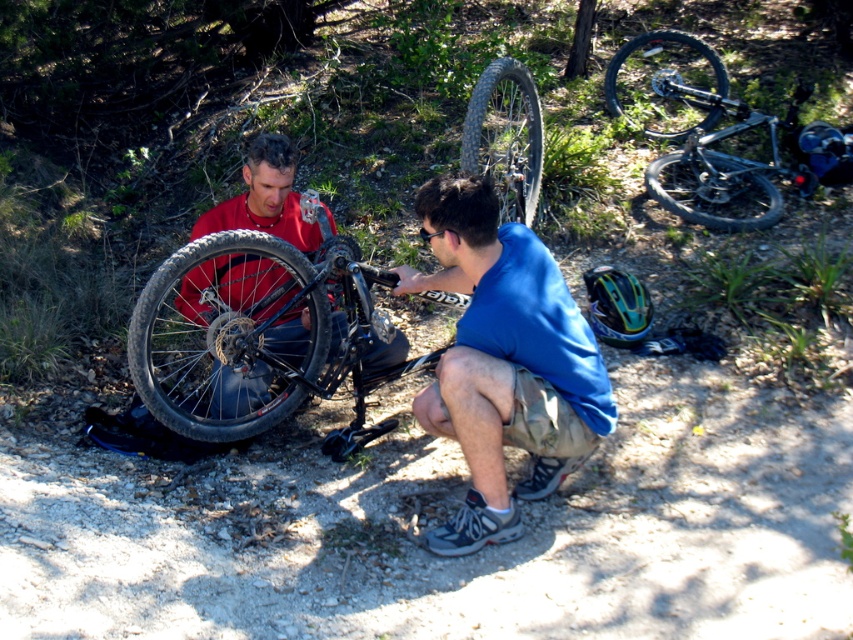
You are standing at the center of the image and want to locate the point marked as point (705, 132). Based on the scene description, where exactly on the black matte mountain bike at upper right would this point be located?

The point (705, 132) is located on the black matte mountain bike at upper right.

You are a photographer trying to capture a clear shot of the blue fabric shirt at center and the black matte bicycle wheel at upper right. Based on their sizes in the image, which object would appear larger in your photo?

The blue fabric shirt at center appears larger in the photo because it is much taller than the black matte bicycle wheel at upper right.